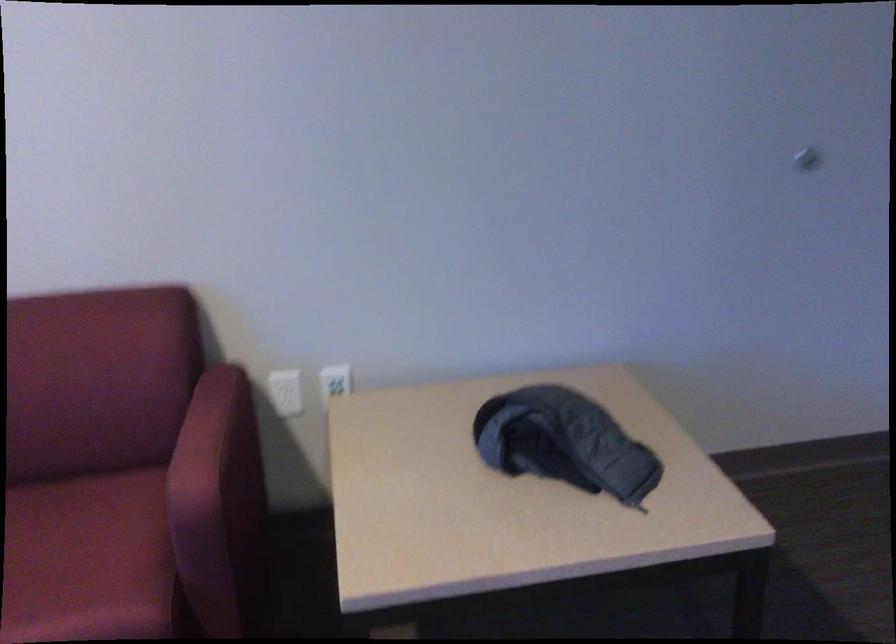
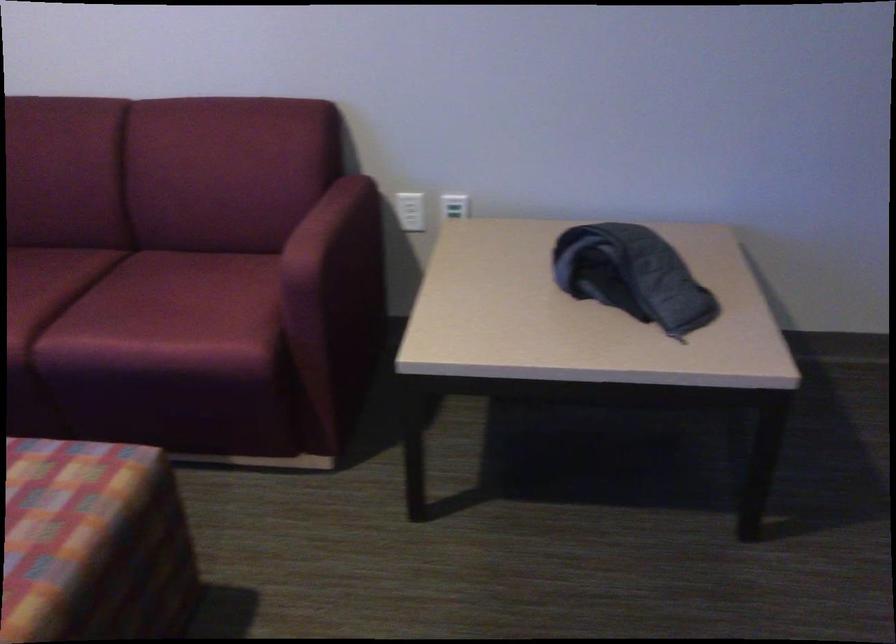
The images are taken continuously from a first-person perspective. In which direction are you moving?

The movement direction of the cameraman is right, backward.